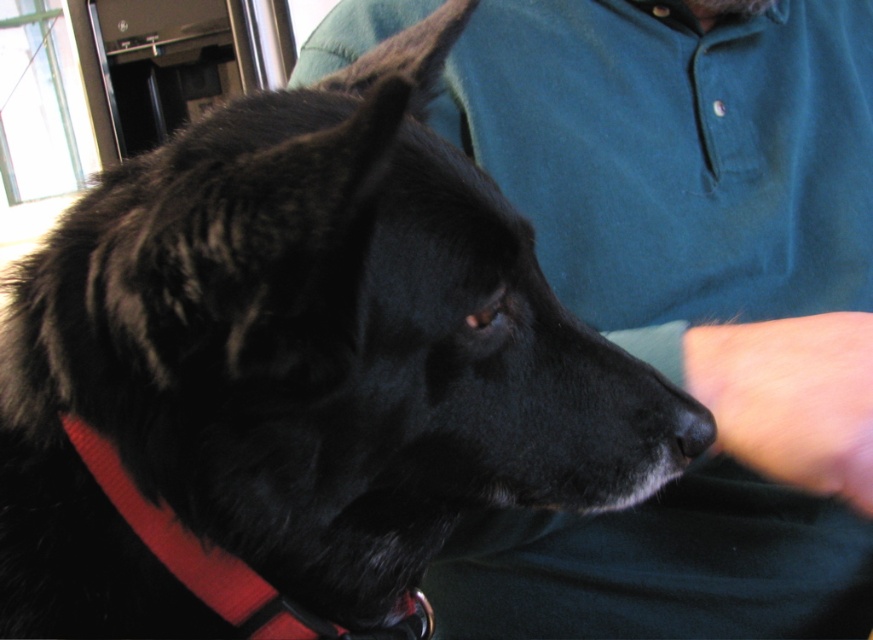
You are a photographer adjusting your camera settings. You notice two elements in the frame, the smooth skin at lower right and the red nylon collar at lower left. Which element is closer to your camera?

The smooth skin at lower right is closer to the camera because it is further to the viewer than the red nylon collar at lower left.

You are a photographer trying to capture the black dog with its red collar. You notice the green cotton shirt in the background. Which object, the green cotton shirt at upper center or the red nylon collar at lower left, is taller in the photo?

The green cotton shirt at upper center is taller than the red nylon collar at lower left.

Looking at the image, where is the smooth skin at lower right located? Please provide coordinates in the format of point followed by the coordinate values.

The smooth skin at lower right is located at point (791, 397).